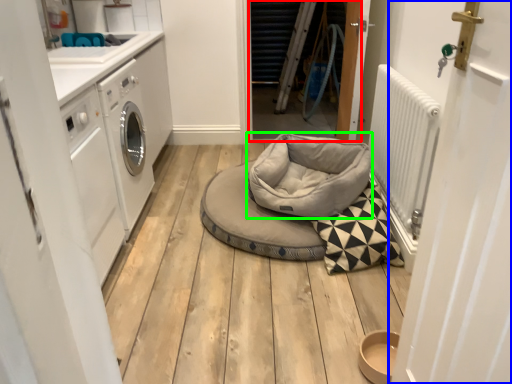
Question: Which is farther away from door (highlighted by a red box)? door (highlighted by a blue box) or dog bed (highlighted by a green box)?

Choices:
 (A) door
 (B) dog bed

Answer: (A)